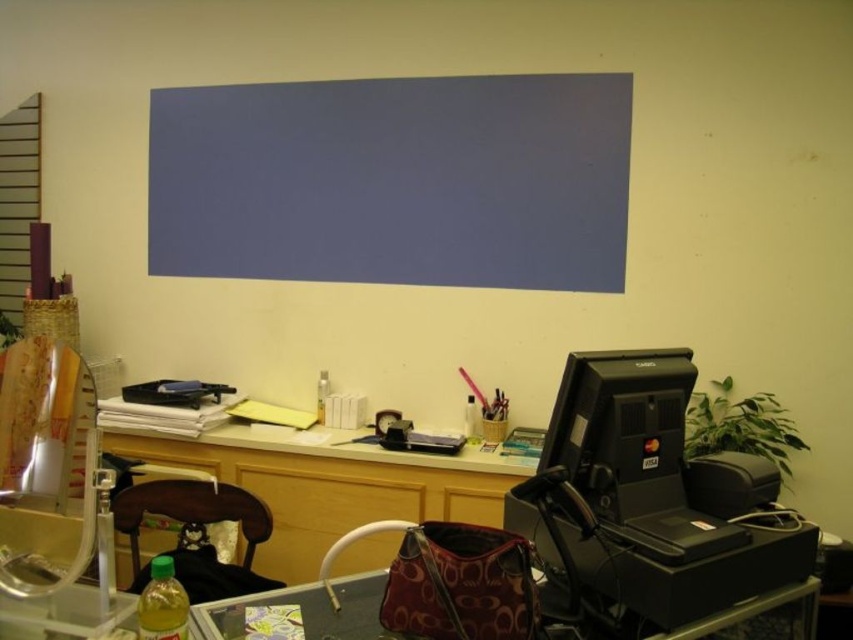
Which is more to the left, wooden desk at center or leather-like brown bag at lower center?

wooden desk at center is more to the left.

The height and width of the screenshot is (640, 853). Describe the element at coordinates (323, 484) in the screenshot. I see `wooden desk at center` at that location.

I want to click on wooden desk at center, so click(323, 484).

This screenshot has height=640, width=853. In order to click on wooden desk at center in this screenshot , I will do `click(323, 484)`.

Between wooden desk at center and brown wood chair at lower left, which one appears on the left side from the viewer's perspective?

brown wood chair at lower left is more to the left.

Looking at this image, is wooden desk at center bigger than brown wood chair at lower left?

Indeed, wooden desk at center has a larger size compared to brown wood chair at lower left.

The width and height of the screenshot is (853, 640). Find the location of `wooden desk at center`. wooden desk at center is located at coordinates click(x=323, y=484).

This screenshot has height=640, width=853. Identify the location of wooden desk at center. (323, 484).

Who is taller, black plastic printer at lower right or wooden desk at center?

Standing taller between the two is wooden desk at center.

Between point (630, 385) and point (480, 502), which one is positioned behind?

The point (480, 502) is more distant.

Is point (579, 435) in front of point (349, 468)?

Yes, it is.

At what (x,y) coordinates should I click in order to perform the action: click on black plastic printer at lower right. Please return your answer as a coordinate pair (x, y). Looking at the image, I should click on (648, 504).